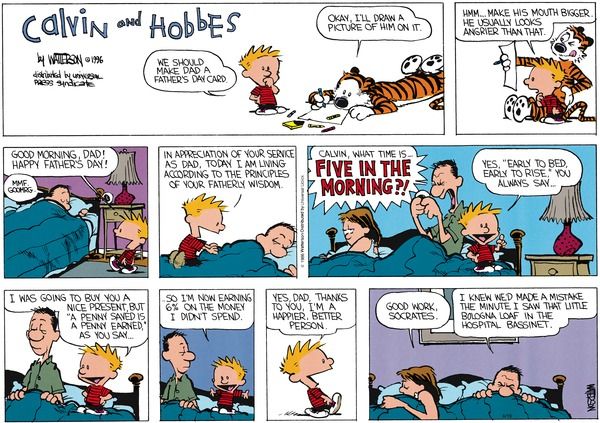
Find the location of a particular element. The image size is (600, 423). cartoon pillows is located at coordinates (77, 205), (10, 203), (291, 257), (383, 250), (465, 246), (78, 392), (202, 398), (385, 388), (477, 383).